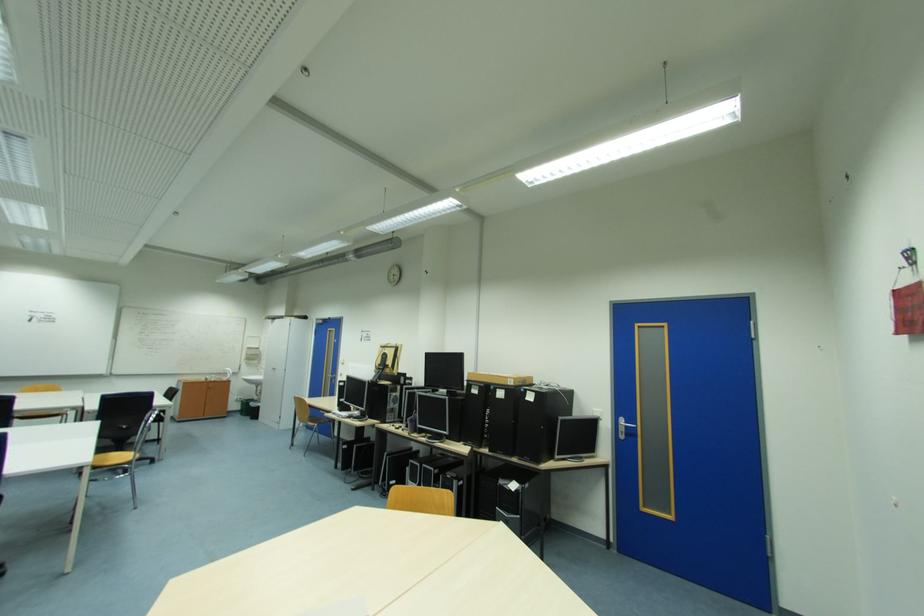
The location [499,379] corresponds to which object?

It corresponds to the cardboard box in the image.